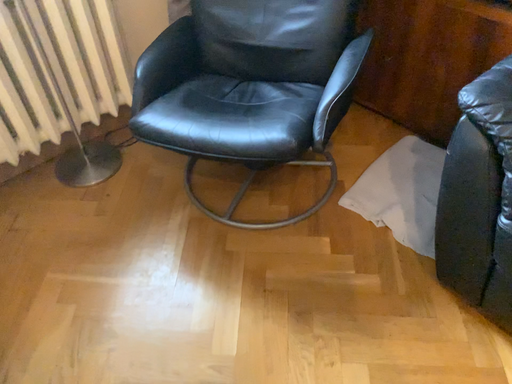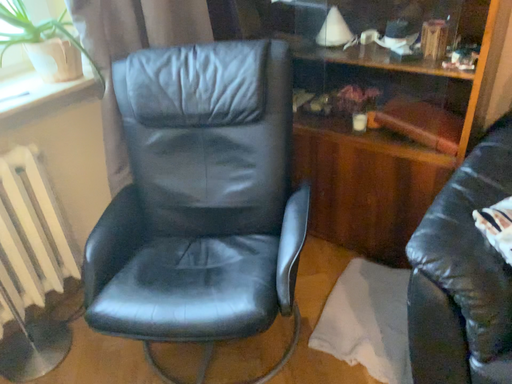
Question: How did the camera likely rotate when shooting the video?

Choices:
 (A) rotated left
 (B) rotated right

Answer: (B)